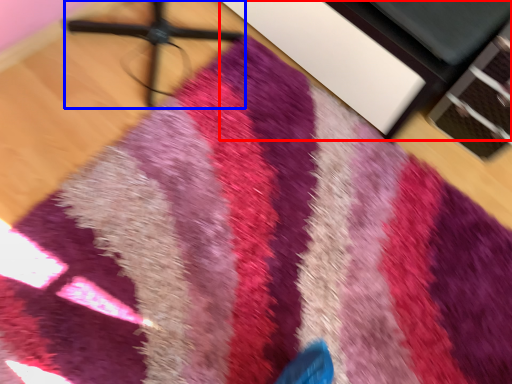
Question: Which point is closer to the camera, furniture (highlighted by a red box) or tripod (highlighted by a blue box)?

Choices:
 (A) furniture
 (B) tripod

Answer: (B)